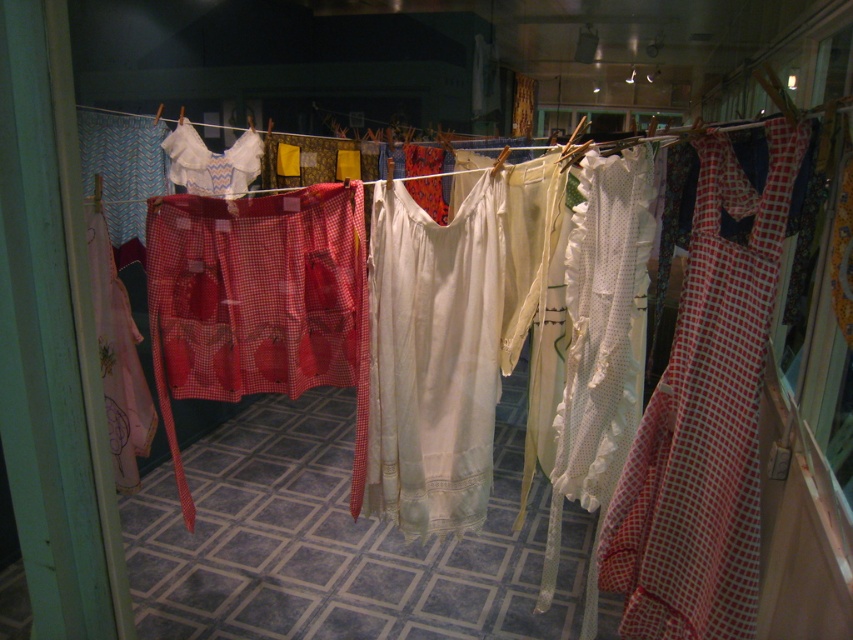
Question: Which point is farther to the camera?

Choices:
 (A) white cotton dress at center
 (B) red checkered dress at right

Answer: (A)

Question: Is red checkered dress at right to the left of white lace blouse at center from the viewer's perspective?

Choices:
 (A) yes
 (B) no

Answer: (B)

Question: Can you confirm if red checkered dress at right is positioned above white cotton dress at center?

Choices:
 (A) no
 (B) yes

Answer: (A)

Question: Which of the following is the farthest from the observer?

Choices:
 (A) (244, 173)
 (B) (718, 538)
 (C) (418, 218)

Answer: (A)

Question: Observing the image, what is the correct spatial positioning of red checkered dress at right in reference to white cotton dress at center?

Choices:
 (A) left
 (B) right

Answer: (B)

Question: Which of the following is the farthest from the observer?

Choices:
 (A) white cotton dress at center
 (B) white lace blouse at center
 (C) red checkered dress at right

Answer: (B)